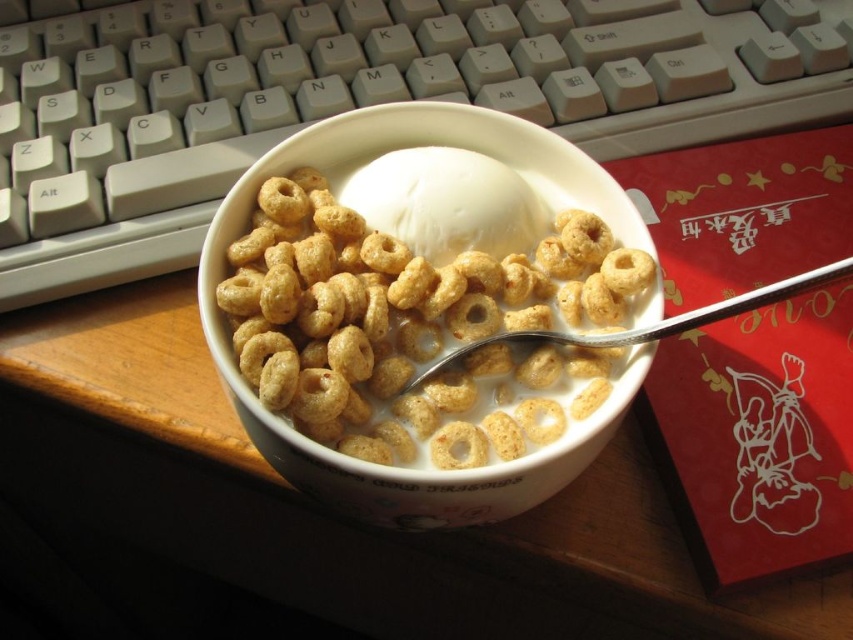
You are sitting at the desk and want to place a sticker exactly halfway between point (126,163) and point (366,179). Will the sticker be closer to the bowl of cereal or the keyboard?

The sticker placed halfway between point (126,163) and point (366,179) will be closer to the bowl of cereal because point (126,163) is closer to the viewer than point (366,179), so the midpoint leans towards the bowl.

You are organizing items on a desk and need to place a water bottle between the white plastic keyboard at upper center and the white creamy ice cream at center. Can the water bottle fit in the space between them?

The distance between the white plastic keyboard at upper center and the white creamy ice cream at center is 27.84 centimeters, so a standard water bottle which is about 8 centimeters in diameter can easily fit in the space between them.

You are looking at the image of the cereal bowl and the keyboard. There are two points marked in the image. Which point is closer to you, point (456, 156) or point (518, 332)?

Point (456, 156) is closer to the viewer than point (518, 332).